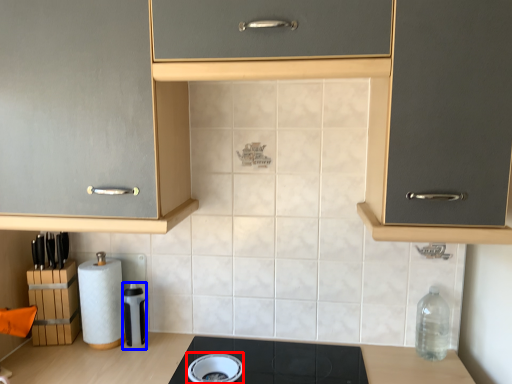
Question: Which object appears closest to the camera in this image, appliance (highlighted by a red box) or appliance (highlighted by a blue box)?

Choices:
 (A) appliance
 (B) appliance

Answer: (A)